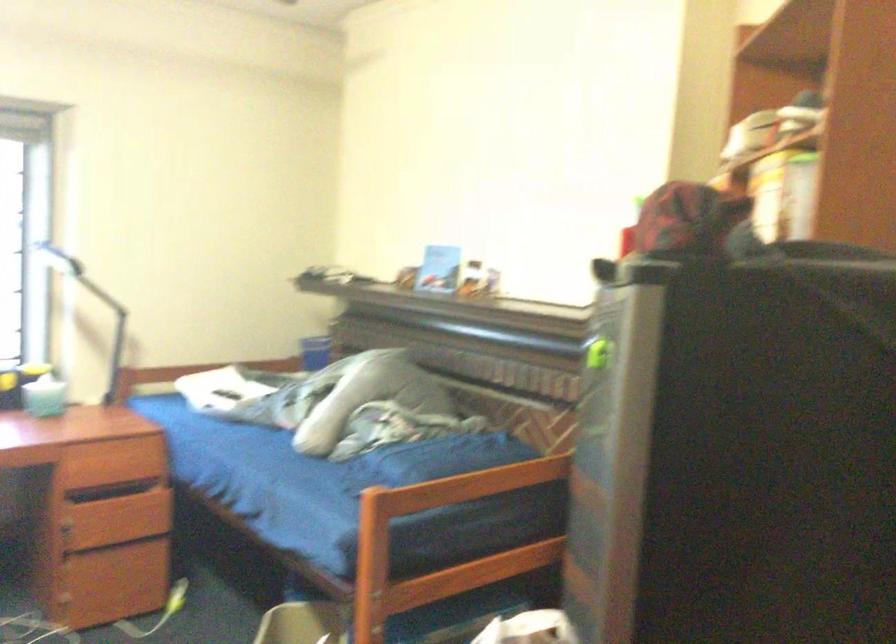
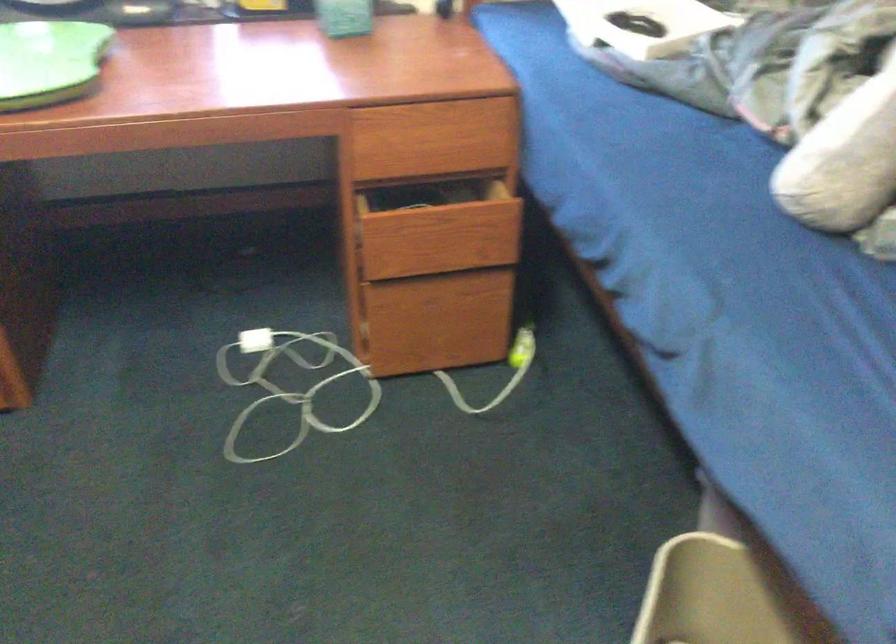
The point at (115,457) is marked in the first image. Where is the corresponding point in the second image?

(435, 136)